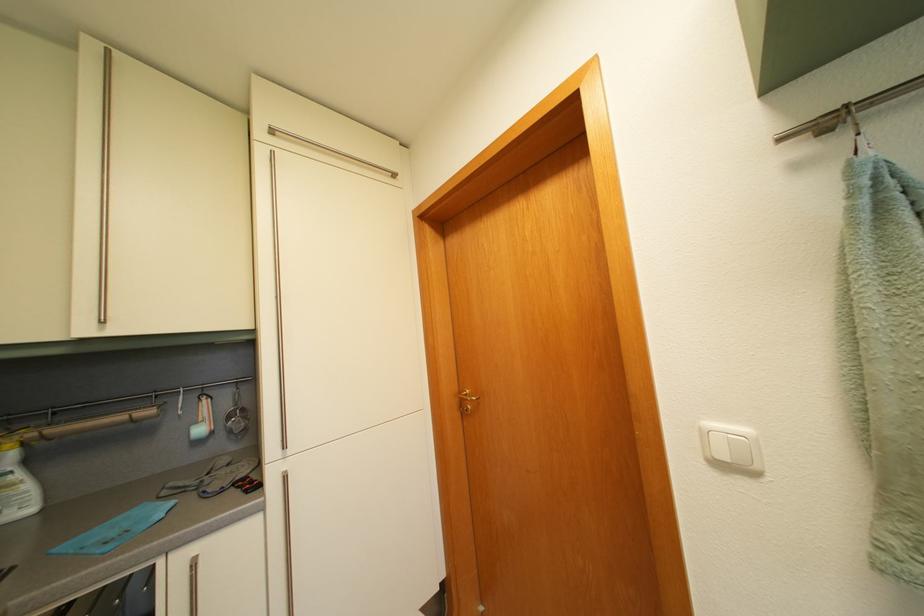
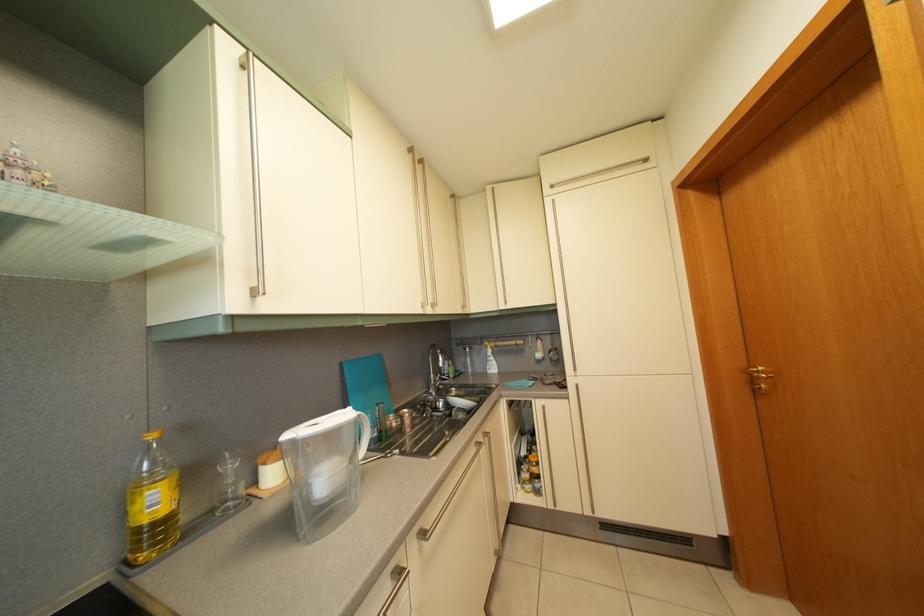
Question: The first image is from the beginning of the video and the second image is from the end. How did the camera likely rotate when shooting the video?

Choices:
 (A) Left
 (B) Right
 (C) Up
 (D) Down

Answer: (A)